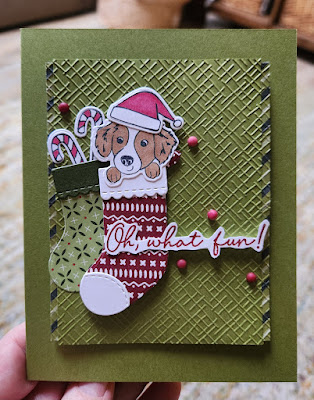
Locate an element on the screen. carpet area possibly is located at coordinates (304, 374), (303, 309).